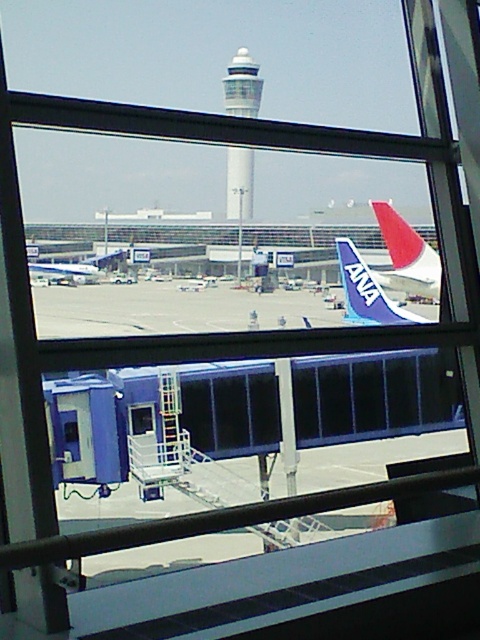
Looking at this image, you are standing inside the airport terminal and want to know how far the point at coordinates (249, 76) is from you. Can you determine the distance?

The point at coordinates (249, 76) is 28.90 meters away from you.

You are standing inside the airport terminal and looking through the window. There are two points marked on the window at coordinates point (255, 88) and point (91, 268). Which point is closer to your eyes?

Point (91, 268) is closer to your eyes because it is less further to the camera than point (255, 88).

You are standing in the airport terminal and want to know how far the point at coordinates (218,321) is from you. Can you determine the distance?

The point at coordinates (218,321) is 27.23 meters away from the viewer.